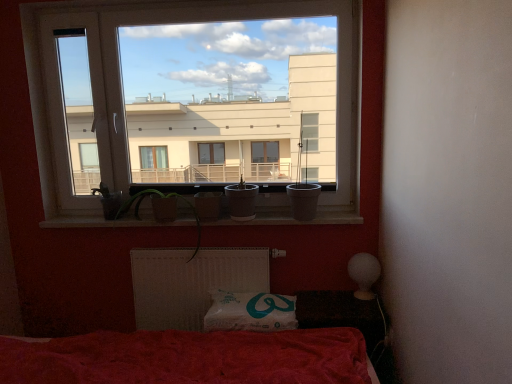
This screenshot has height=384, width=512. I want to click on vacant region above white fabric pillow at lower center (from a real-world perspective), so click(259, 296).